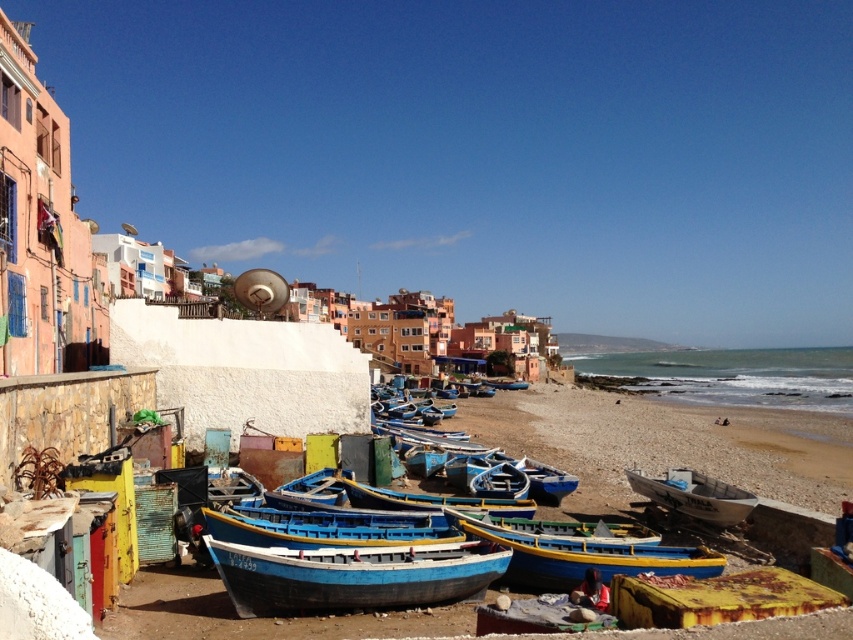
Based on the photo, measure the distance from blue painted wood boat at center to white matte boat at center.

blue painted wood boat at center is 12.31 meters from white matte boat at center.

Which is in front, point (268, 513) or point (744, 502)?

Point (268, 513) is more forward.

Measure the distance between blue painted wood boat at center and camera.

15.70 meters

Identify the location of blue painted wood boat at center. (325, 529).

Does yellow painted wood canoe at center appear under white matte boat at center?

No, yellow painted wood canoe at center is not below white matte boat at center.

Between point (503, 532) and point (682, 468), which one is positioned in front?

Point (503, 532)

Locate an element on the screen. The width and height of the screenshot is (853, 640). yellow painted wood canoe at center is located at coordinates (589, 557).

Does point (386, 602) come farther from viewer compared to point (563, 561)?

No, it is in front of (563, 561).

Between blue painted wood boat at lower center and yellow painted wood canoe at center, which one has less height?

With less height is yellow painted wood canoe at center.

The height and width of the screenshot is (640, 853). I want to click on blue painted wood boat at lower center, so click(352, 576).